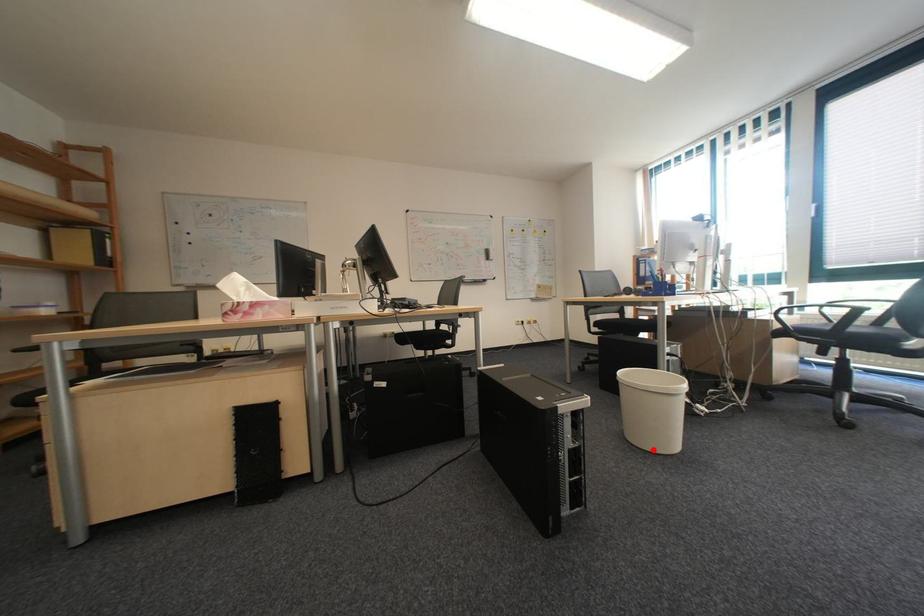
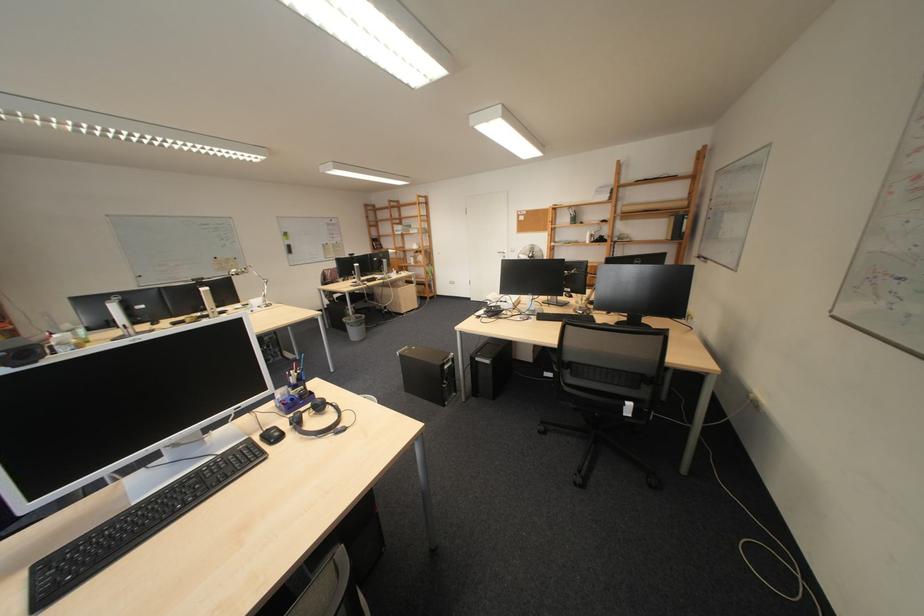
Question: I am providing you with two images of the same scene from different viewpoints. A red point is marked on the first image. At the location where the point appears in image 1, is it still visible in image 2?

Choices:
 (A) Yes
 (B) No

Answer: (B)